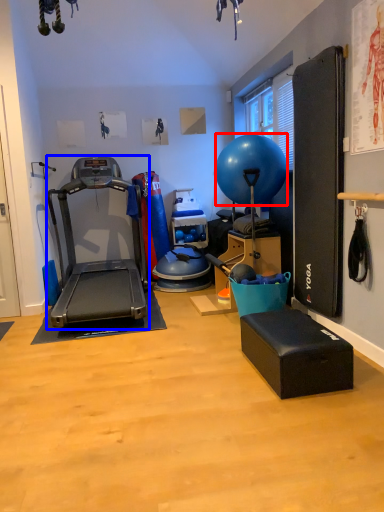
Question: Which point is closer to the camera, ball (highlighted by a red box) or treadmill (highlighted by a blue box)?

Choices:
 (A) ball
 (B) treadmill

Answer: (B)